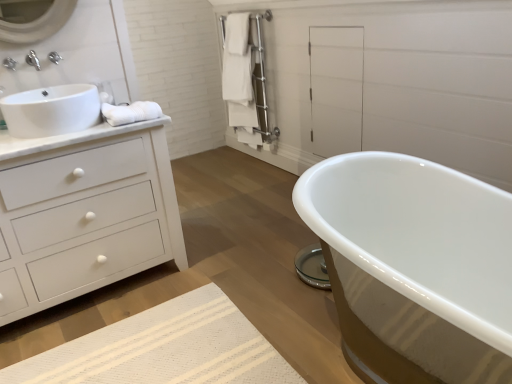
Where is `free spot above white glossy sink at left (from a real-world perspective)`? The height and width of the screenshot is (384, 512). free spot above white glossy sink at left (from a real-world perspective) is located at coordinates (54, 90).